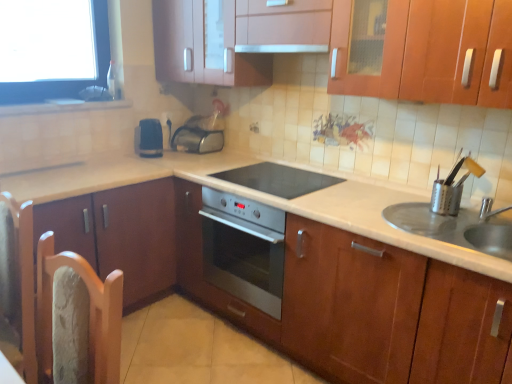
This screenshot has width=512, height=384. I want to click on vacant region to the left of metallic silver utensil holder at right, the 3th appliance when ordered from top to bottom, so click(414, 211).